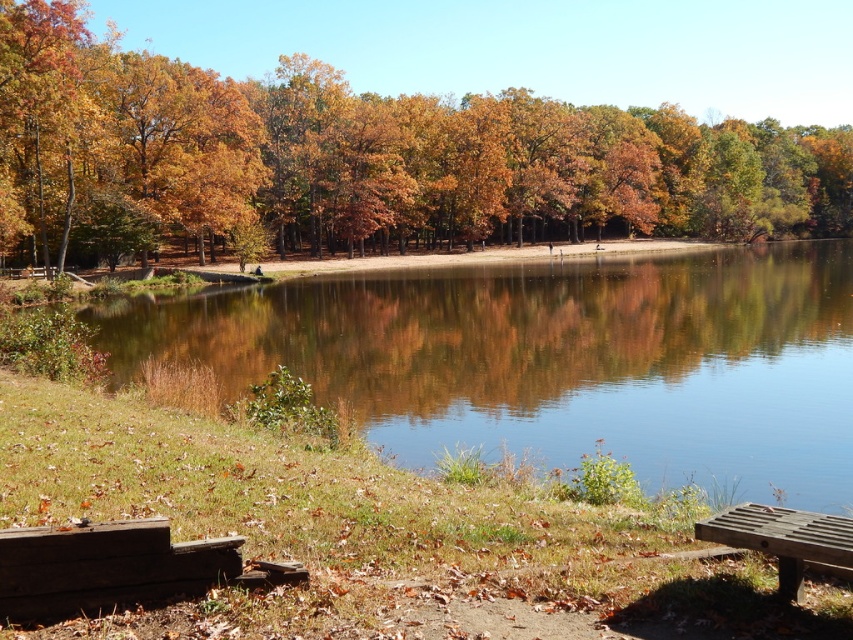
Question: Is golden-brown leaves at center wider than dark brown wooden bench at lower left?

Choices:
 (A) yes
 (B) no

Answer: (A)

Question: Which object is closer to the camera taking this photo?

Choices:
 (A) wooden bench at lower right
 (B) golden-brown leaves at center
 (C) clear water at center

Answer: (A)

Question: Among these objects, which one is nearest to the camera?

Choices:
 (A) dark brown wooden bench at lower left
 (B) golden-brown leaves at center

Answer: (A)

Question: Which of the following is the closest to the observer?

Choices:
 (A) wooden bench at lower right
 (B) dark brown wooden bench at lower left

Answer: (B)

Question: Does golden-brown leaves at center appear over clear water at center?

Choices:
 (A) no
 (B) yes

Answer: (B)

Question: Is the position of clear water at center less distant than that of wooden bench at lower right?

Choices:
 (A) no
 (B) yes

Answer: (A)